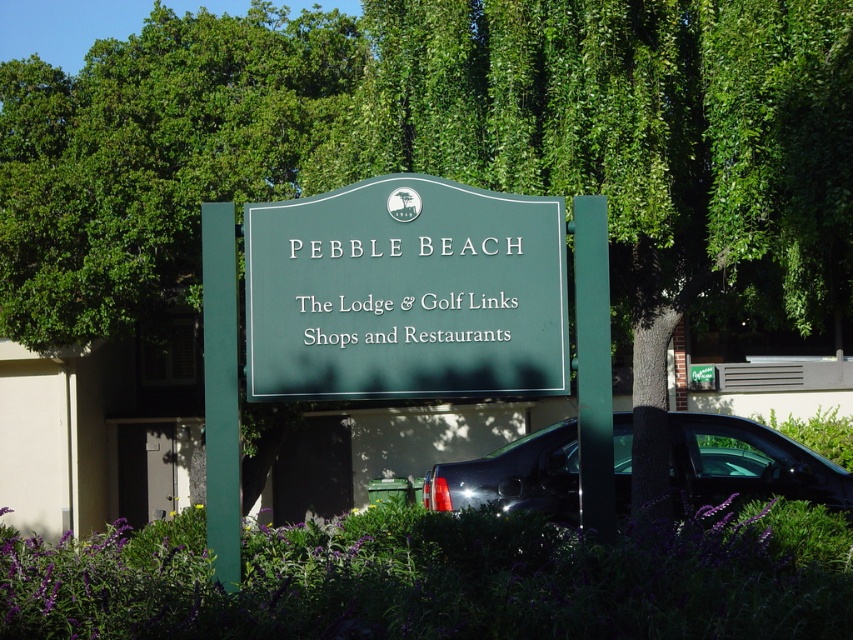
You are a photographer wanting to capture the purple leafy bush at lower center and the glossy black truck at lower right in the same frame. Based on their positions, which object should you place on the left side of your camera viewfinder to include both?

To include both the purple leafy bush at lower center and the glossy black truck at lower right in the same frame, you should position the purple leafy bush at lower center on the left side of the camera viewfinder since it is to the left of the glossy black truck at lower right.

You are standing in front of the green signboard and want to take a photo. There are two points marked on the signboard at coordinates point (399, 595) and point (480, 499). Which point is closer to you when you are facing the signboard?

Point (399, 595) is closer to the camera than point (480, 499), so when facing the signboard, point (399, 595) is closer to you.

You are a gardener who needs to move the purple leafy bush at lower center and the green polished wood sign at center to make space for a new pathway. Based on their sizes, which object should you move first to ensure the pathway is wide enough?

The purple leafy bush at lower center has a larger width than the green polished wood sign at center, so you should move the purple leafy bush at lower center first to accommodate the pathway.